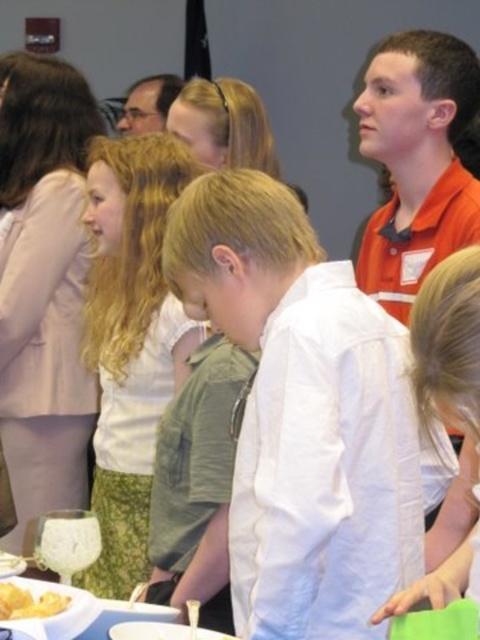
Which is behind, point (44, 628) or point (151, 634)?

The point (151, 634) is more distant.

Does white matte platter at lower left have a greater height compared to white matte plate at lower center?

Indeed, white matte platter at lower left has a greater height compared to white matte plate at lower center.

Find the location of a particular element. Image resolution: width=480 pixels, height=640 pixels. white matte platter at lower left is located at coordinates (64, 609).

Can you confirm if white smooth shirt at center is bigger than white frosted cake at lower left?

Correct, white smooth shirt at center is larger in size than white frosted cake at lower left.

Is white smooth shirt at center to the left of white frosted cake at lower left from the viewer's perspective?

Incorrect, white smooth shirt at center is not on the left side of white frosted cake at lower left.

In order to click on white smooth shirt at center in this screenshot , I will do `click(307, 416)`.

Can you confirm if light brown hair at center is thinner than white matte plate at lower center?

Incorrect, light brown hair at center's width is not less than white matte plate at lower center's.

Is point (132, 259) farther from viewer compared to point (153, 632)?

Yes.

Find the location of a particular element. light brown hair at center is located at coordinates (131, 340).